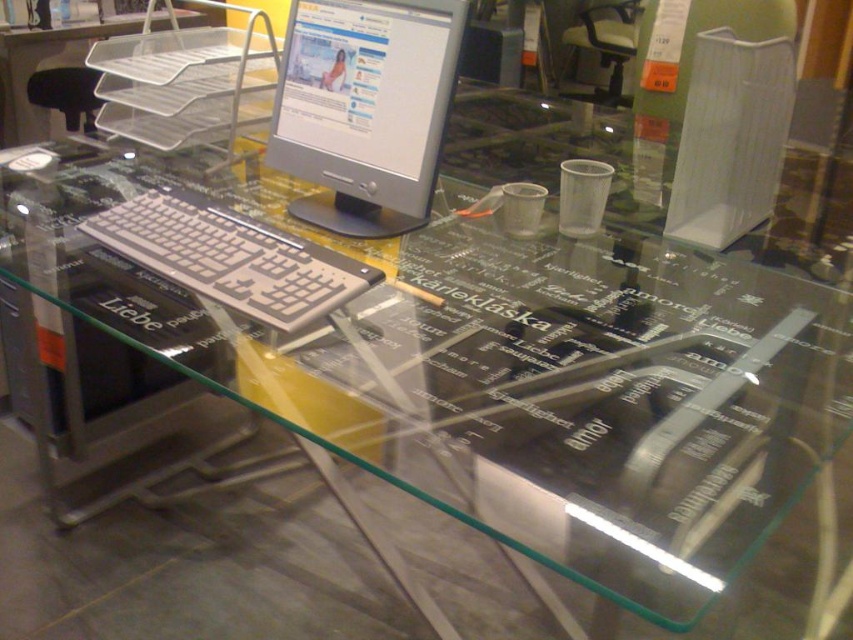
You are setting up a new desk arrangement and want to place both the silver metallic computer monitor at upper center and the silver metallic keyboard at center on your desk. Given that the monitor is larger, where should you position the keyboard relative to the monitor to ensure there is enough space for both?

Since the silver metallic computer monitor at upper center is larger than the silver metallic keyboard at center, you should position the keyboard to the side or below the monitor to accommodate their sizes and maintain sufficient workspace.

You are setting up a new monitor in your office. The monitor has a specific point at coordinates point (x=364, y=108). According to the image provided, where is this point located on the monitor?

The point (x=364, y=108) is located on the silver metallic computer monitor at upper center.

Based on the photo, you are standing in front of the modern office workstation setup. You need to reach the silver metallic computer monitor at upper center to adjust its settings. Considering your arm length is 2.5 feet, can you comfortably reach the monitor without moving closer?

The silver metallic computer monitor at upper center is 3.62 feet away from the viewer. Since your arm length is 2.5 feet, you cannot comfortably reach it without moving closer because the distance is greater than your arm span.